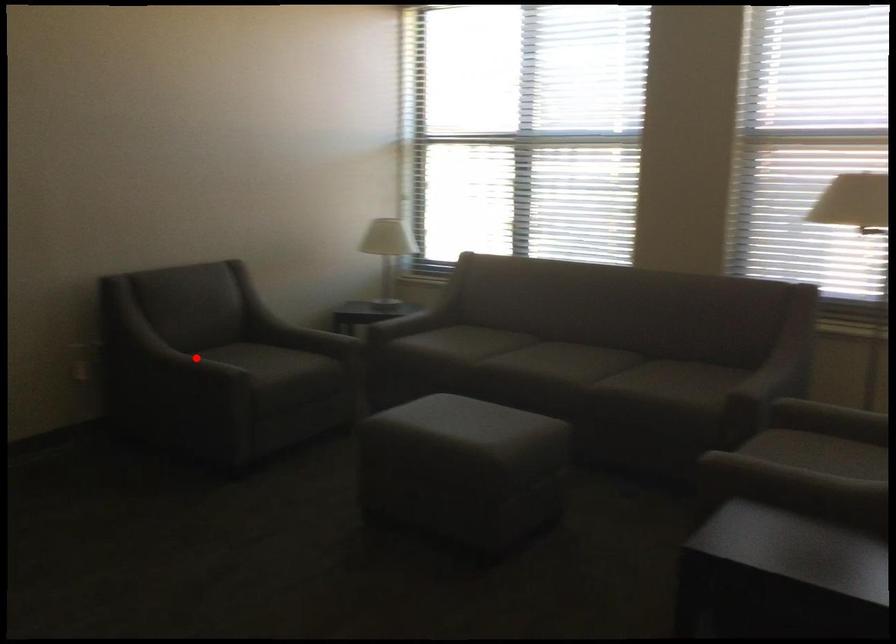
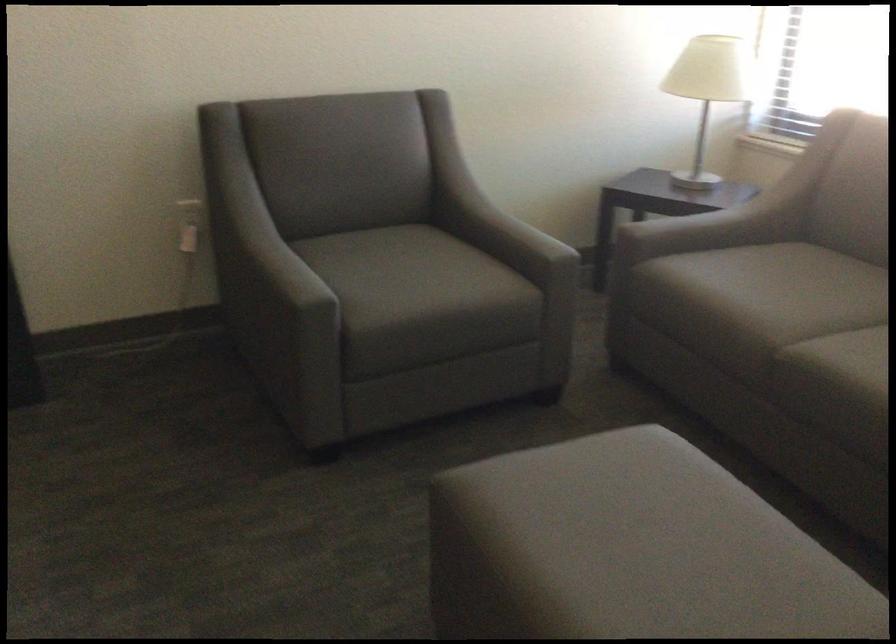
Question: I am providing you with two images of the same scene from different viewpoints. Image1 has a red point marked. In image2, the corresponding 3D location appears at what relative position? Reply with the corresponding letter.

Choices:
 (A) Closer
 (B) Farther

Answer: (A)